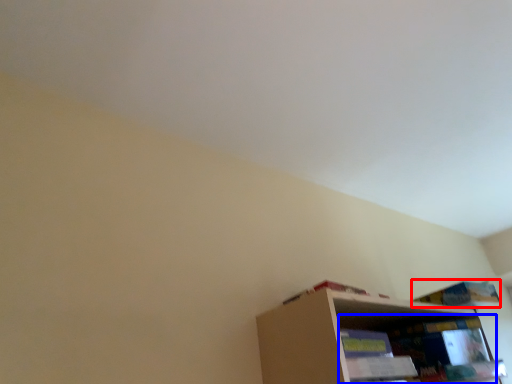
Question: Which point is further to the camera, book (highlighted by a red box) or shelf (highlighted by a blue box)?

Choices:
 (A) book
 (B) shelf

Answer: (A)